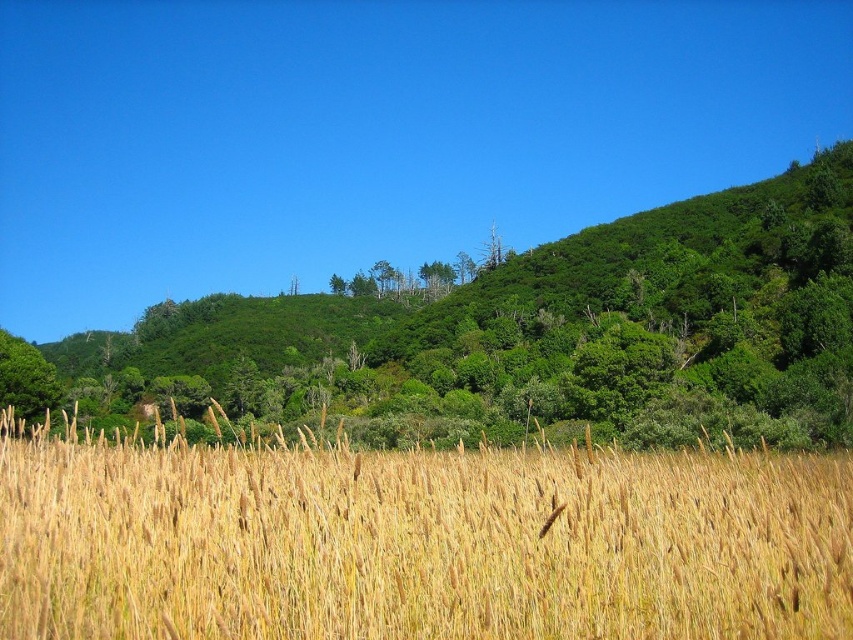
Question: Where is golden grass at center located in relation to green leafy tree at upper center in the image?

Choices:
 (A) left
 (B) right

Answer: (B)

Question: Is golden grass at center smaller than green leafy tree at left?

Choices:
 (A) no
 (B) yes

Answer: (A)

Question: Among these objects, which one is nearest to the camera?

Choices:
 (A) green leafy tree at left
 (B) green leafy tree at upper center
 (C) golden grass at center

Answer: (C)

Question: Is green leafy tree at upper center smaller than green leafy tree at left?

Choices:
 (A) no
 (B) yes

Answer: (A)

Question: Which point is closer to the camera?

Choices:
 (A) green leafy tree at upper center
 (B) green leafy tree at left
 (C) golden grass at center

Answer: (C)

Question: Which point appears closest to the camera in this image?

Choices:
 (A) (10, 362)
 (B) (581, 477)

Answer: (B)